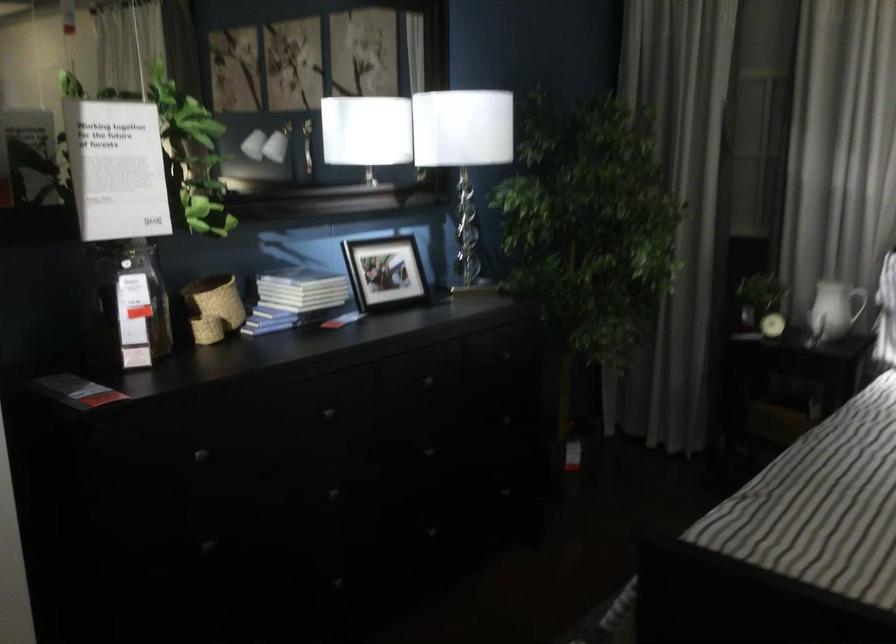
What do you see at coordinates (823, 313) in the screenshot? The height and width of the screenshot is (644, 896). I see `a white pitcher handle` at bounding box center [823, 313].